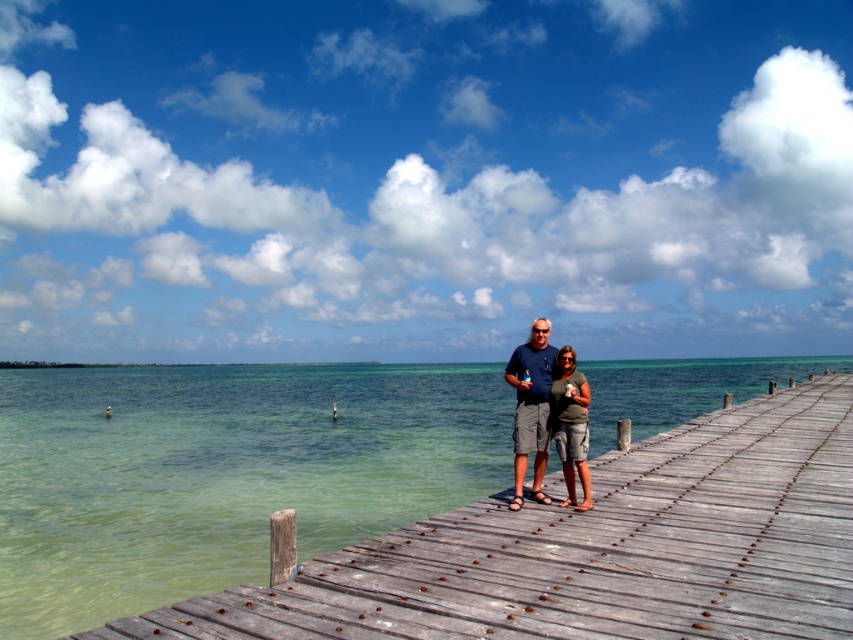
Question: Which point appears farthest from the camera in this image?

Choices:
 (A) (540, 433)
 (B) (567, 442)
 (C) (850, 600)

Answer: (A)

Question: Is the position of wooden dock at center less distant than that of matte gray shorts at center?

Choices:
 (A) no
 (B) yes

Answer: (B)

Question: Among these objects, which one is nearest to the camera?

Choices:
 (A) wooden dock at center
 (B) matte gray shorts at center
 (C) green cotton shirt at center

Answer: (A)

Question: Can you confirm if wooden dock at center is smaller than green cotton shirt at center?

Choices:
 (A) yes
 (B) no

Answer: (B)

Question: Which point is closer to the camera taking this photo?

Choices:
 (A) (575, 385)
 (B) (532, 465)

Answer: (A)

Question: Is wooden dock at center further to camera compared to green cotton shirt at center?

Choices:
 (A) yes
 (B) no

Answer: (B)